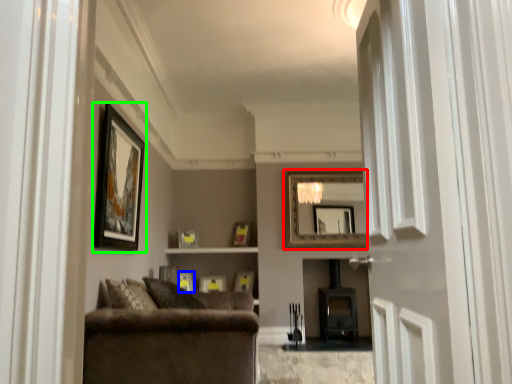
Question: Which is nearer to the mirror (highlighted by a red box)? picture frame (highlighted by a blue box) or picture frame (highlighted by a green box).

Choices:
 (A) picture frame
 (B) picture frame

Answer: (A)